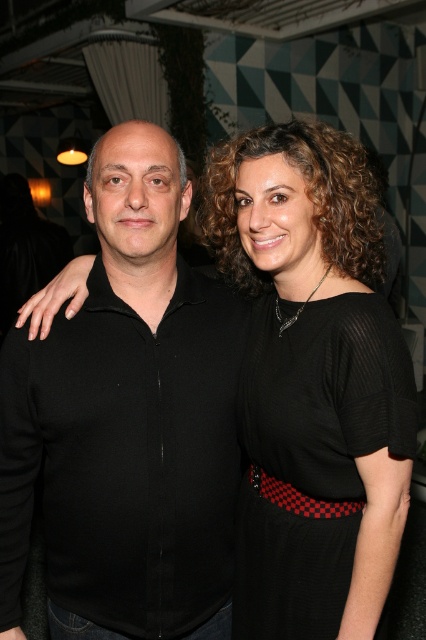
You are a photographer trying to adjust the lighting for a photo shoot. You notice two outfits in the frame, a black matte shirt at center and a black mesh dress at center. Which outfit should you focus your lighting on to ensure it stands out more against the background?

The black mesh dress at center is behind the black matte shirt at center, so focusing the lighting on the black matte shirt at center will make it stand out more as it is in front and closer to the camera.

You are a photographer trying to adjust the framing of two people in the image. The black matte shirt at center and the black mesh dress at center are both in the shot. Which one should you focus on if you want to highlight the taller subject?

Answer: The black mesh dress at center is taller than the black matte shirt at center, so you should focus on the black mesh dress at center to highlight the taller subject.

Based on the photo, you are a photographer standing at the edge of the room. You want to take a clear photo of the black matte shirt at center without any blur. The camera you have requires a minimum distance of 4 feet to focus properly. Do you need to move closer or farther away to ensure the photo is in focus?

The black matte shirt at center and viewer are 3.54 feet apart from each other. Since the required minimum distance is 4 feet, you need to move 0.46 feet farther away to ensure the photo is in focus.